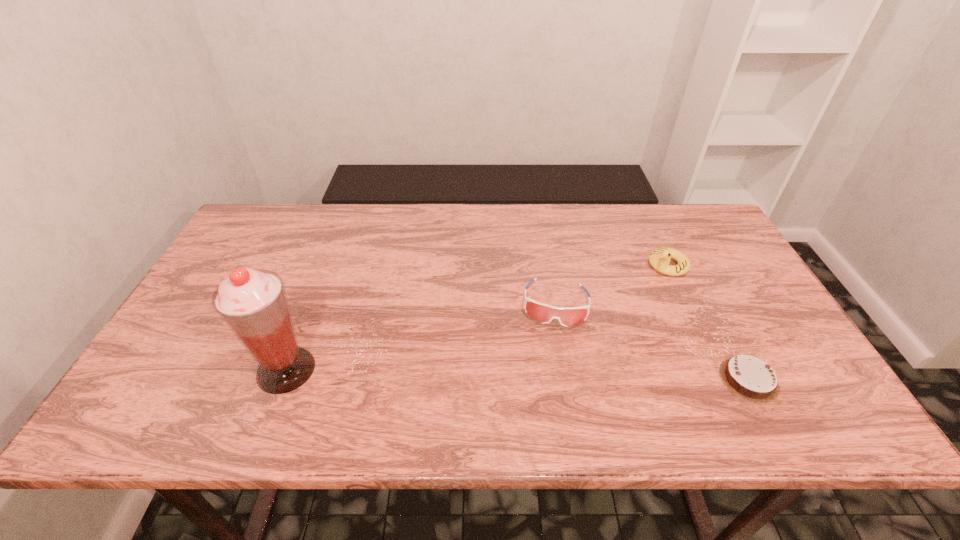
Find the location of a particular element. The width and height of the screenshot is (960, 540). vacant spot on the desktop that is between the leftmost object and the shortest object and is positioned on the front-facing side of the third nearest object is located at coordinates click(x=550, y=375).

Image resolution: width=960 pixels, height=540 pixels. I want to click on vacant space on the desktop that is between the tallest object and the chocolate cake and is positioned on the face of the duckling, so click(x=503, y=374).